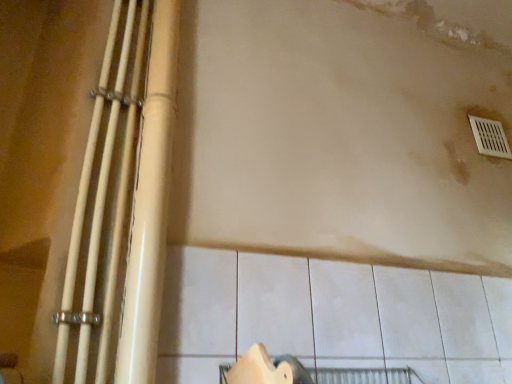
Describe the element at coordinates (150, 205) in the screenshot. I see `matte beige pipes at left, the first beam positioned from the right` at that location.

Where is `white plastic vent at upper right`? The image size is (512, 384). white plastic vent at upper right is located at coordinates (490, 137).

The height and width of the screenshot is (384, 512). In order to click on white glossy pipes at left, the 2th beam viewed from the right in this screenshot , I will do `click(103, 206)`.

From the image's perspective, which object appears higher, white plastic vent at upper right or white glossy pipes at left, the 2th beam viewed from the right?

white plastic vent at upper right.

How many degrees apart are the facing directions of white plastic vent at upper right and white glossy pipes at left, the 2th beam viewed from the right?

There is a 0.178-degree angle between the facing directions of white plastic vent at upper right and white glossy pipes at left, the 2th beam viewed from the right.

From a real-world perspective, is white plastic vent at upper right above or below white glossy pipes at left, the 2th beam viewed from the right?

In terms of real-world spatial position, white plastic vent at upper right is above white glossy pipes at left, the 2th beam viewed from the right.

Between white plastic vent at upper right and white glossy pipes at left, positioned as the first beam in left-to-right order, which one has larger size?

white glossy pipes at left, positioned as the first beam in left-to-right order.

Between white glossy pipes at left, positioned as the first beam in left-to-right order, and white plastic vent at upper right, which one has less height?

white plastic vent at upper right is shorter.

Which is more to the right, white glossy pipes at left, positioned as the first beam in left-to-right order, or white plastic vent at upper right?

white plastic vent at upper right.

Is white glossy pipes at left, positioned as the first beam in left-to-right order, in front of or behind white plastic vent at upper right in the image?

In the image, white glossy pipes at left, positioned as the first beam in left-to-right order, appears in front of white plastic vent at upper right.

Which of these two, matte beige pipes at left, which is counted as the second beam, starting from the left, or white glossy pipes at left, positioned as the first beam in left-to-right order, is wider?

Wider between the two is matte beige pipes at left, which is counted as the second beam, starting from the left.

Can you confirm if matte beige pipes at left, which is counted as the second beam, starting from the left, is smaller than white glossy pipes at left, positioned as the first beam in left-to-right order?

No.

Looking at this image, considering the sizes of objects matte beige pipes at left, the first beam positioned from the right, and white glossy pipes at left, the 2th beam viewed from the right, in the image provided, who is shorter, matte beige pipes at left, the first beam positioned from the right, or white glossy pipes at left, the 2th beam viewed from the right,?

With less height is white glossy pipes at left, the 2th beam viewed from the right.

From a real-world perspective, is matte beige pipes at left, which is counted as the second beam, starting from the left, under white glossy pipes at left, the 2th beam viewed from the right?

No, from a real-world perspective, matte beige pipes at left, which is counted as the second beam, starting from the left, is not under white glossy pipes at left, the 2th beam viewed from the right.

Between white glossy pipes at left, the 2th beam viewed from the right, and matte beige pipes at left, the first beam positioned from the right, which one is positioned behind?

matte beige pipes at left, the first beam positioned from the right, is further from the camera.

Is white glossy pipes at left, the 2th beam viewed from the right, oriented away from matte beige pipes at left, the first beam positioned from the right?

No, matte beige pipes at left, the first beam positioned from the right, is not at the back of white glossy pipes at left, the 2th beam viewed from the right.

How different are the orientations of white glossy pipes at left, positioned as the first beam in left-to-right order, and matte beige pipes at left, the first beam positioned from the right, in degrees?

2.4 degrees.

Considering the relative sizes of white glossy pipes at left, the 2th beam viewed from the right, and matte beige pipes at left, which is counted as the second beam, starting from the left, in the image provided, is white glossy pipes at left, the 2th beam viewed from the right, thinner than matte beige pipes at left, which is counted as the second beam, starting from the left,?

Yes, white glossy pipes at left, the 2th beam viewed from the right, is thinner than matte beige pipes at left, which is counted as the second beam, starting from the left.

Which object is further away from the camera, matte beige pipes at left, which is counted as the second beam, starting from the left, or white plastic vent at upper right?

white plastic vent at upper right is further from the camera.

How many degrees apart are the facing directions of matte beige pipes at left, the first beam positioned from the right, and white plastic vent at upper right?

2.58 degrees separate the facing orientations of matte beige pipes at left, the first beam positioned from the right, and white plastic vent at upper right.

In the scene shown: Is matte beige pipes at left, which is counted as the second beam, starting from the left, thinner than white plastic vent at upper right?

Incorrect, the width of matte beige pipes at left, which is counted as the second beam, starting from the left, is not less than that of white plastic vent at upper right.

From a real-world perspective, is white plastic vent at upper right positioned above or below matte beige pipes at left, which is counted as the second beam, starting from the left?

In terms of real-world spatial position, white plastic vent at upper right is above matte beige pipes at left, which is counted as the second beam, starting from the left.

Looking at this image, is matte beige pipes at left, the first beam positioned from the right, at the back of white plastic vent at upper right?

That's not correct — white plastic vent at upper right is not looking away from matte beige pipes at left, the first beam positioned from the right.

Identify the location of window lying on the right of matte beige pipes at left, which is counted as the second beam, starting from the left. Image resolution: width=512 pixels, height=384 pixels. (490, 137).

Based on the photo, is white plastic vent at upper right closer to camera compared to matte beige pipes at left, which is counted as the second beam, starting from the left?

No, the depth of white plastic vent at upper right is greater than that of matte beige pipes at left, which is counted as the second beam, starting from the left.

I want to click on window above the white glossy pipes at left, positioned as the first beam in left-to-right order (from the image's perspective), so click(x=490, y=137).

Image resolution: width=512 pixels, height=384 pixels. Find the location of `the 2nd beam below the white plastic vent at upper right (from a real-world perspective)`. the 2nd beam below the white plastic vent at upper right (from a real-world perspective) is located at coordinates (103, 206).

Considering their positions, is white plastic vent at upper right positioned closer to white glossy pipes at left, the 2th beam viewed from the right, than matte beige pipes at left, the first beam positioned from the right?

Among the two, matte beige pipes at left, the first beam positioned from the right, is located nearer to white glossy pipes at left, the 2th beam viewed from the right.

Considering their positions, is white plastic vent at upper right positioned further to matte beige pipes at left, which is counted as the second beam, starting from the left, than white glossy pipes at left, the 2th beam viewed from the right?

The object further to matte beige pipes at left, which is counted as the second beam, starting from the left, is white plastic vent at upper right.

Which object lies nearer to the anchor point white glossy pipes at left, the 2th beam viewed from the right, matte beige pipes at left, the first beam positioned from the right, or white plastic vent at upper right?

matte beige pipes at left, the first beam positioned from the right, lies closer to white glossy pipes at left, the 2th beam viewed from the right, than the other object.

From the image, which object appears to be farther from white plastic vent at upper right, white glossy pipes at left, the 2th beam viewed from the right, or matte beige pipes at left, which is counted as the second beam, starting from the left?

white glossy pipes at left, the 2th beam viewed from the right, is further to white plastic vent at upper right.

Considering their positions, is matte beige pipes at left, the first beam positioned from the right, positioned closer to white plastic vent at upper right than white glossy pipes at left, positioned as the first beam in left-to-right order?

matte beige pipes at left, the first beam positioned from the right, lies closer to white plastic vent at upper right than the other object.

Based on their spatial positions, is white glossy pipes at left, the 2th beam viewed from the right, or white plastic vent at upper right further from matte beige pipes at left, the first beam positioned from the right?

white plastic vent at upper right is positioned further to the anchor matte beige pipes at left, the first beam positioned from the right.

I want to click on beam situated between white glossy pipes at left, positioned as the first beam in left-to-right order, and white plastic vent at upper right from left to right, so click(x=150, y=205).